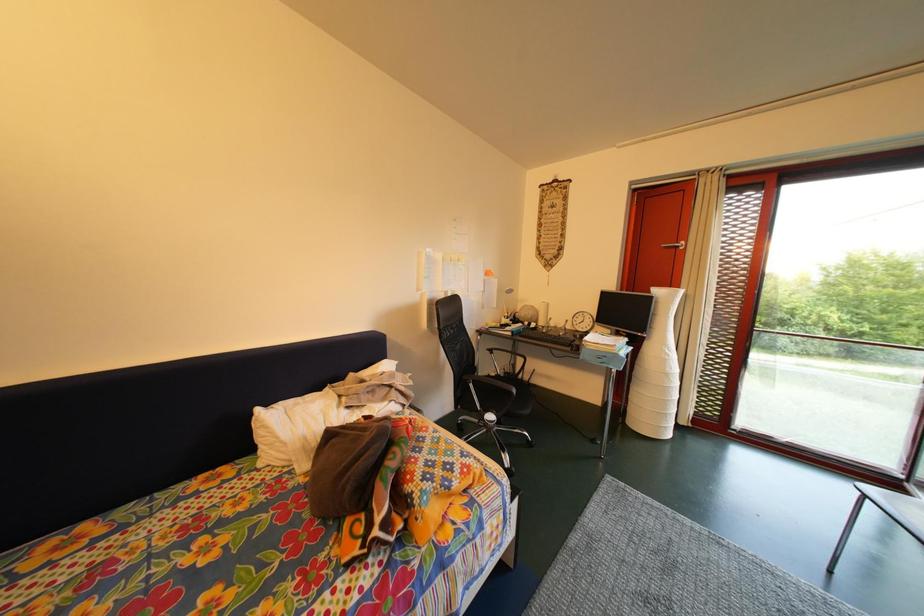
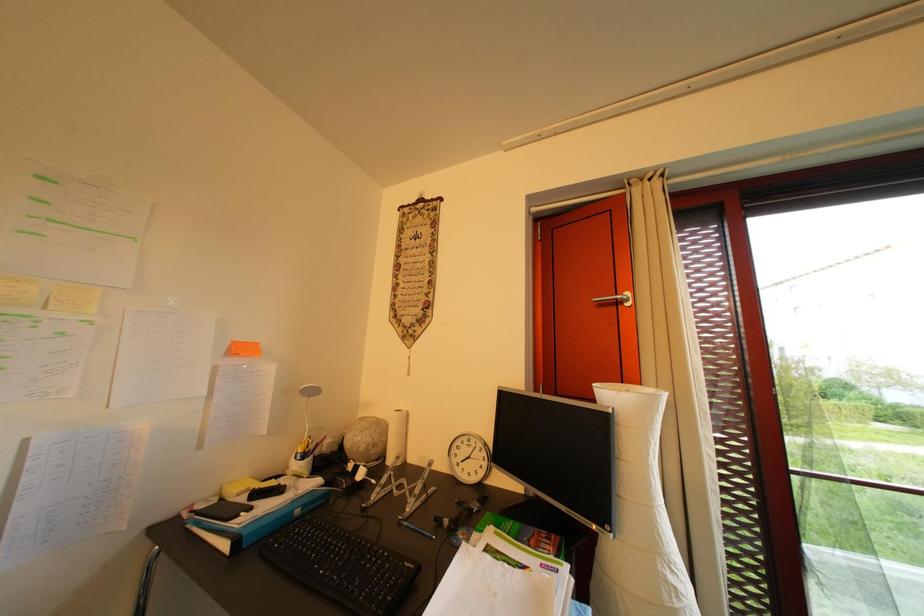
The images are taken continuously from a first-person perspective. In which direction are you moving?

The cameraman moved toward right, forward.